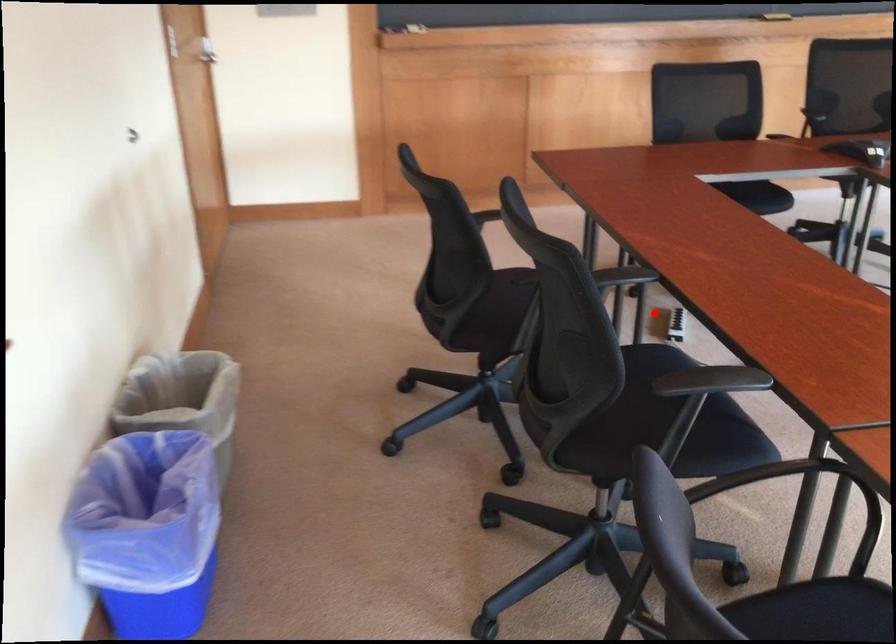
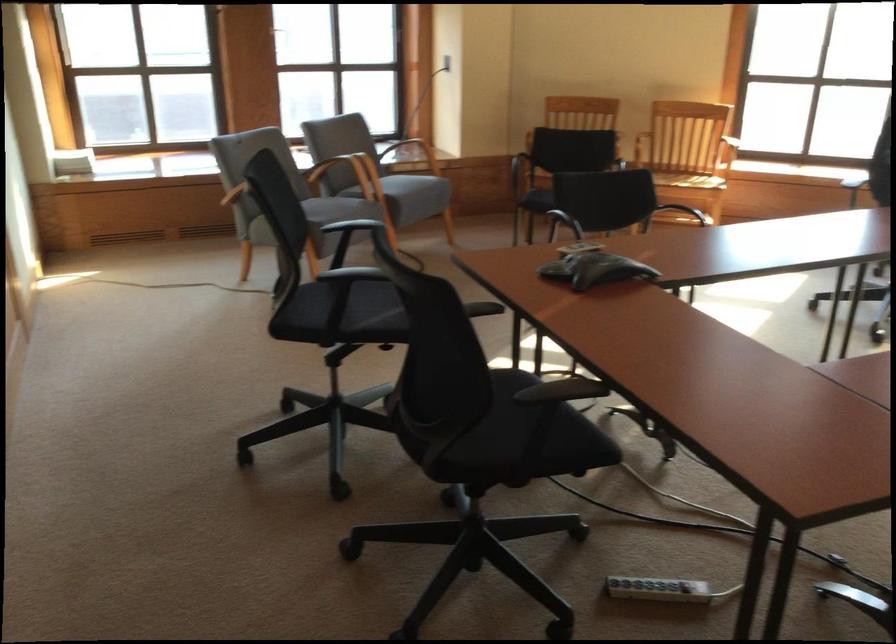
Find the pixel in the second image that matches the highlighted location in the first image.

(657, 589)